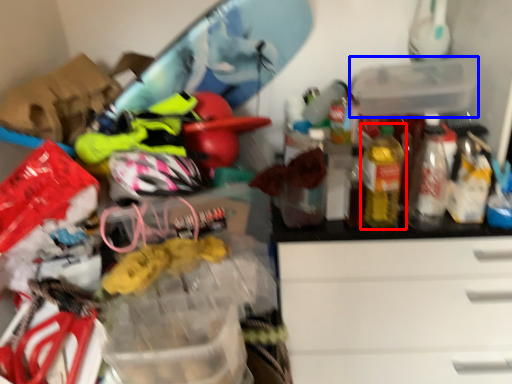
Question: Among these objects, which one is farthest to the camera, bottle (highlighted by a red box) or storage box (highlighted by a blue box)?

Choices:
 (A) bottle
 (B) storage box

Answer: (B)